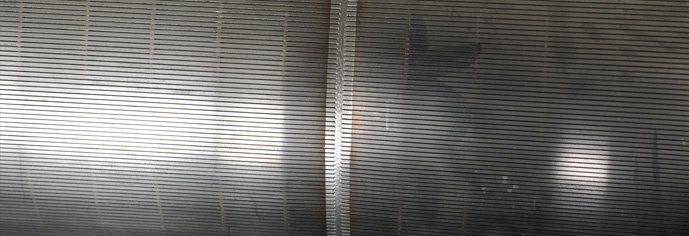
Locate an element on the screen. The height and width of the screenshot is (236, 689). light reflecting on beam is located at coordinates (338, 132).